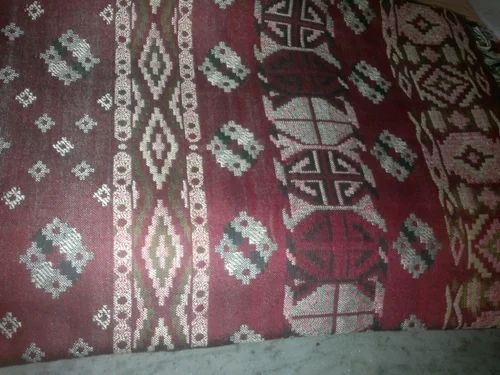
I want to click on darker red background of blanket, so pyautogui.click(x=243, y=292), pyautogui.click(x=427, y=294).